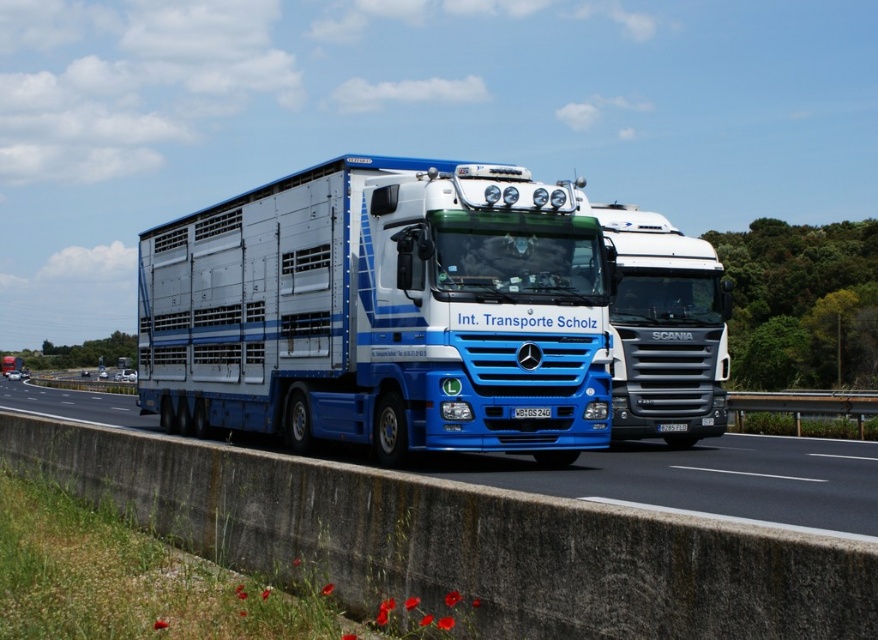
Which of these two, blue glossy truck at center or blue plastic license plate at center, stands shorter?

blue plastic license plate at center

Describe the element at coordinates (704, 477) in the screenshot. I see `blue glossy truck at center` at that location.

You are a GUI agent. You are given a task and a screenshot of the screen. Output one action in this format:
    pyautogui.click(x=<x>, y=<y>)
    Task: Click on the blue glossy truck at center
    
    Given the screenshot: What is the action you would take?
    pyautogui.click(x=704, y=477)

This screenshot has height=640, width=878. I want to click on blue glossy truck at center, so click(x=704, y=477).

Does blue glossy truck at center have a smaller size compared to white plastic license plate at center?

Actually, blue glossy truck at center might be larger than white plastic license plate at center.

Where is `blue glossy truck at center`? This screenshot has width=878, height=640. blue glossy truck at center is located at coordinates (704, 477).

Does blue glossy trailer truck at center have a lesser height compared to blue plastic license plate at center?

No, blue glossy trailer truck at center is not shorter than blue plastic license plate at center.

Locate an element on the screen. blue glossy trailer truck at center is located at coordinates (380, 310).

Where is `blue glossy trailer truck at center`? The image size is (878, 640). blue glossy trailer truck at center is located at coordinates tap(380, 310).